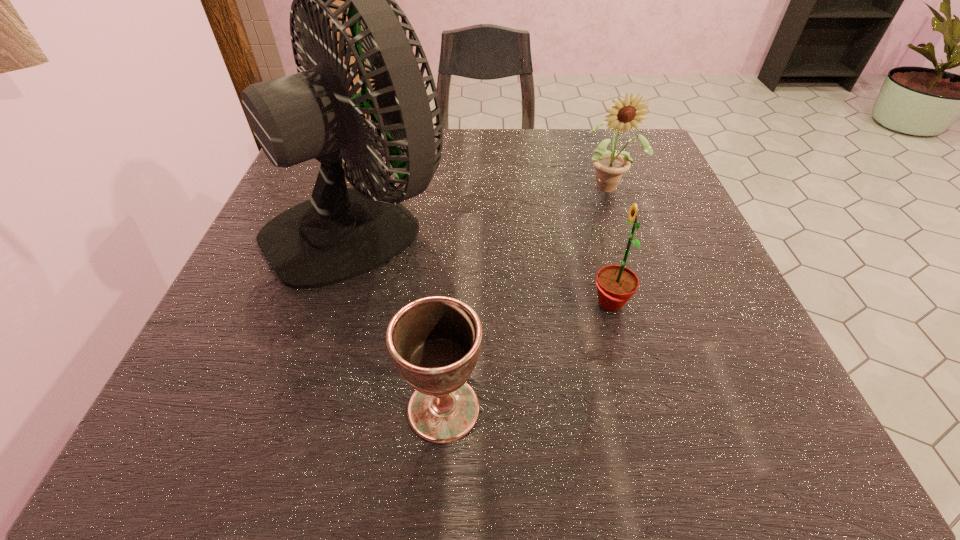
Find the location of `vacant space at the right edge of the desktop`. vacant space at the right edge of the desktop is located at coordinates (778, 392).

Locate an element on the screen. The image size is (960, 540). vacant region at the near left corner of the desktop is located at coordinates (220, 428).

In the image, there is a desktop. Find the location of `blank space at the near right corner`. blank space at the near right corner is located at coordinates (774, 400).

I want to click on free space between the shortest object and the nearer sunflower, so click(527, 356).

Identify the location of vacant area that lies between the farther sunflower and the tallest object. The image size is (960, 540). (485, 204).

Where is `free space between the chalice and the farther sunflower`? free space between the chalice and the farther sunflower is located at coordinates (526, 298).

Identify the location of unoccupied position between the farther sunflower and the nearer sunflower. The image size is (960, 540). (610, 245).

Identify the location of vacant area that lies between the farther sunflower and the chalice. (526, 298).

Locate an element on the screen. Image resolution: width=960 pixels, height=540 pixels. vacant area that lies between the nearer sunflower and the fan is located at coordinates (485, 262).

I want to click on vacant area between the chalice and the nearer sunflower, so click(x=527, y=356).